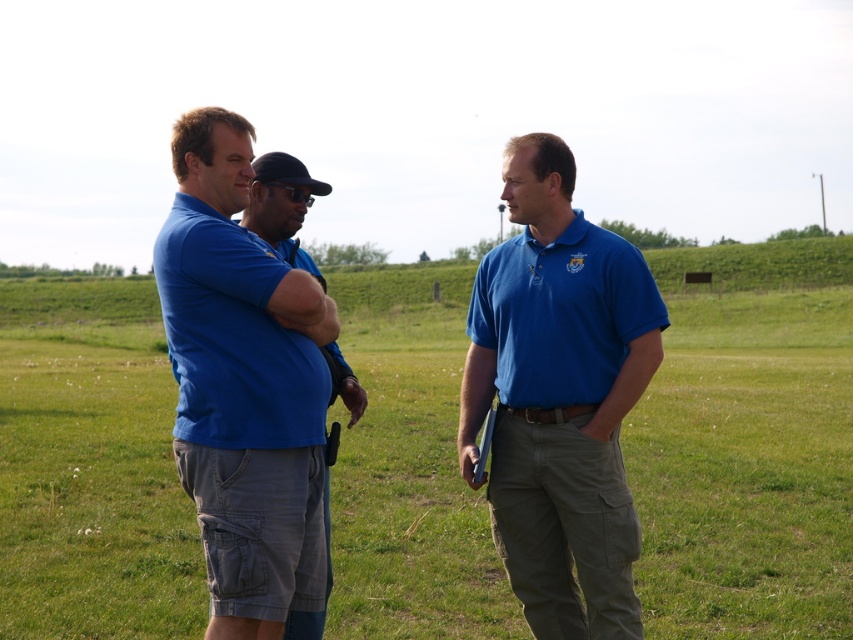
Find the location of a particular element. The height and width of the screenshot is (640, 853). green grass at center is located at coordinates (747, 467).

Is point (122, 371) farther from camera compared to point (548, 298)?

Yes, it is.

Between point (9, 483) and point (532, 371), which one is positioned in front?

Point (532, 371) is more forward.

Locate an element on the screen. The image size is (853, 640). green grass at center is located at coordinates (747, 467).

Looking at this image, is blue cotton shirt at left wider than matte blue polo shirt at center?

Incorrect, blue cotton shirt at left's width does not surpass matte blue polo shirt at center's.

Is blue cotton shirt at left further to the viewer compared to matte blue polo shirt at center?

No, it is not.

This screenshot has height=640, width=853. I want to click on blue cotton shirt at left, so click(x=242, y=385).

Is blue cotton shirt at left wider than matte blue polo shirt at left?

Yes.

How far apart are blue cotton shirt at left and matte blue polo shirt at left?

blue cotton shirt at left is 5.84 inches away from matte blue polo shirt at left.

Is point (282, 483) less distant than point (239, 244)?

No, (282, 483) is behind (239, 244).

Locate an element on the screen. blue cotton shirt at left is located at coordinates (242, 385).